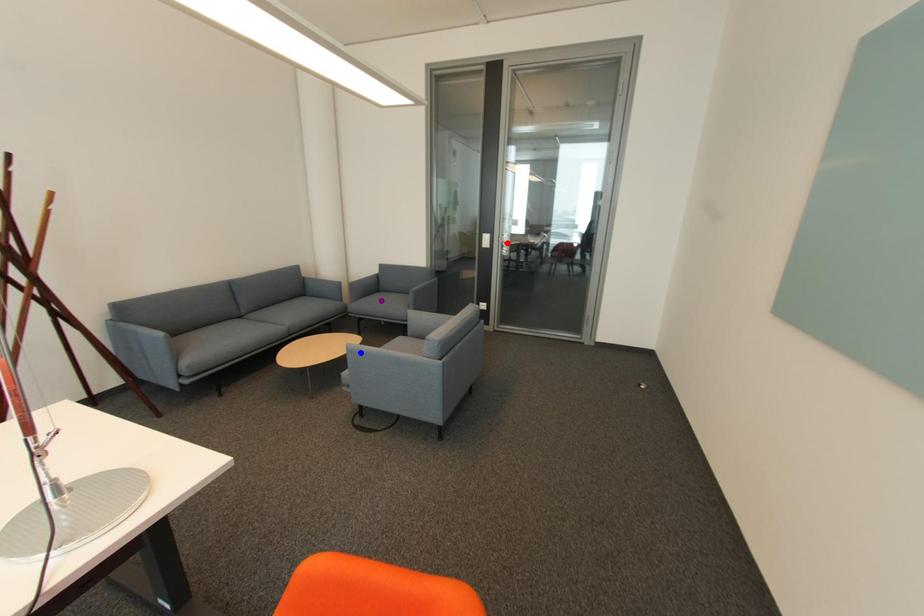
Order these from farthest to nearest:
purple point | blue point | red point

red point → purple point → blue point